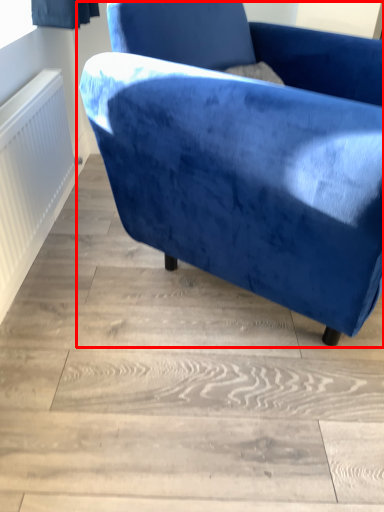
Question: From the image's perspective, considering the relative positions of chair (annotated by the red box) and radiator in the image provided, where is chair (annotated by the red box) located with respect to the staircase?

Choices:
 (A) above
 (B) below

Answer: (A)